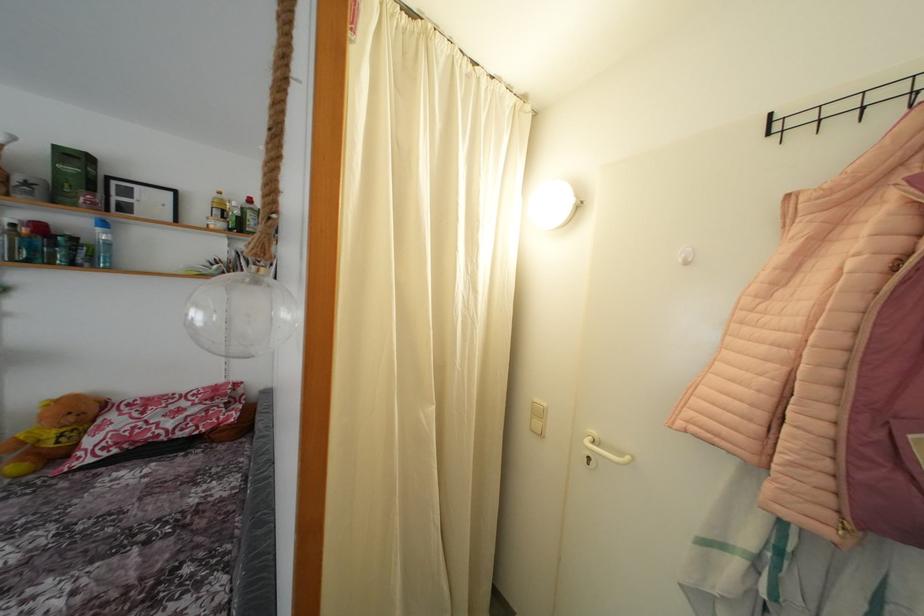
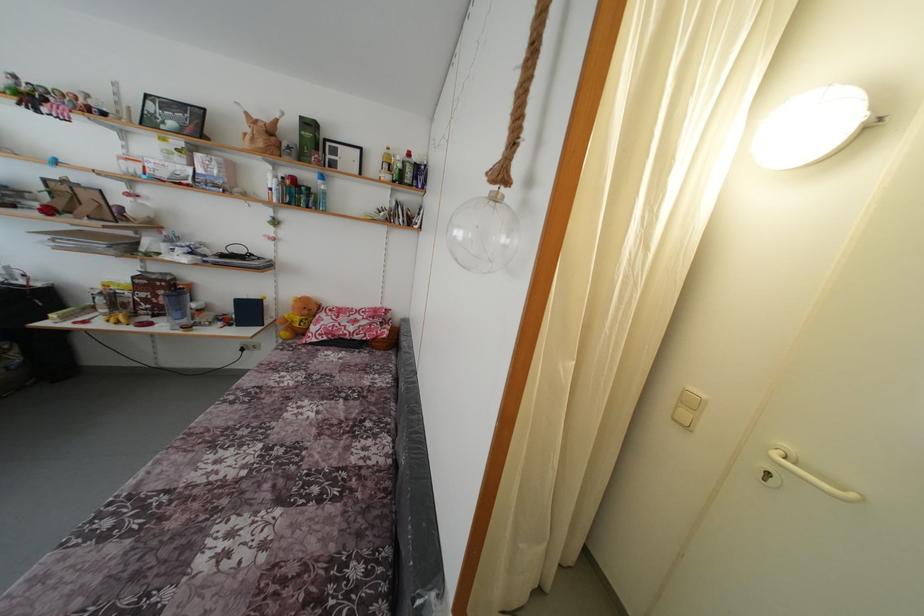
The point at (77, 424) is marked in the first image. Where is the corresponding point in the second image?

(310, 317)